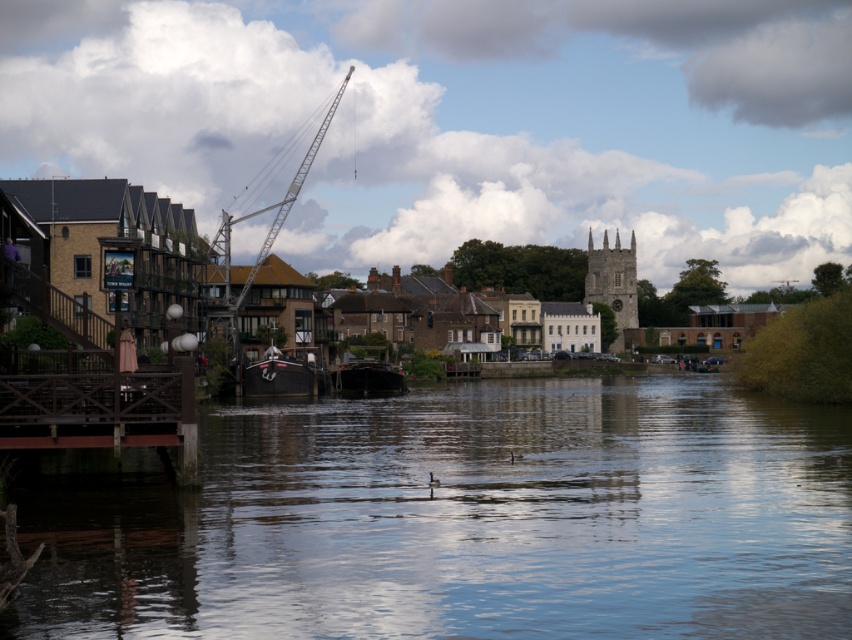
Does transparent water at center have a lesser height compared to dark brown wooden boat at center?

Yes, transparent water at center is shorter than dark brown wooden boat at center.

Can you confirm if transparent water at center is positioned to the left of dark brown wooden boat at center?

No, transparent water at center is not to the left of dark brown wooden boat at center.

Between point (494, 465) and point (348, 362), which one is positioned behind?

Point (348, 362)

At what (x,y) coordinates should I click in order to perform the action: click on transparent water at center. Please return your answer as a coordinate pair (x, y). Looking at the image, I should click on (468, 520).

Where is `transparent water at center`? This screenshot has height=640, width=852. transparent water at center is located at coordinates (468, 520).

Is point (568, 604) closer to viewer compared to point (245, 294)?

Yes, point (568, 604) is in front of point (245, 294).

Which is behind, point (404, 616) or point (283, 198)?

Positioned behind is point (283, 198).

Locate an element on the screen. This screenshot has height=640, width=852. transparent water at center is located at coordinates tap(468, 520).

Who is positioned more to the right, metallic gray crane at upper left or dark brown wooden boat at center?

Positioned to the right is dark brown wooden boat at center.

Who is taller, metallic gray crane at upper left or dark brown wooden boat at center?

metallic gray crane at upper left

Locate an element on the screen. This screenshot has width=852, height=640. metallic gray crane at upper left is located at coordinates (258, 248).